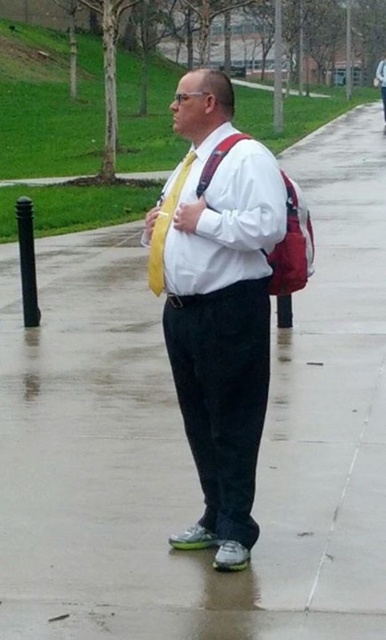
Question: Does white smooth shirt at center have a larger size compared to white matte dress shirt at center?

Choices:
 (A) yes
 (B) no

Answer: (B)

Question: Does matte yellow tie at center have a lesser width compared to yellow satin tie at center?

Choices:
 (A) yes
 (B) no

Answer: (B)

Question: Which point is closer to the camera?

Choices:
 (A) (265, 179)
 (B) (162, 253)
 (C) (384, 83)
 (D) (206, 516)

Answer: (A)

Question: Is the position of matte yellow tie at center more distant than that of white smooth shirt at center?

Choices:
 (A) no
 (B) yes

Answer: (B)

Question: Estimate the real-world distances between objects in this image. Which object is closer to the matte yellow tie at center?

Choices:
 (A) yellow satin tie at center
 (B) white matte dress shirt at center
 (C) white smooth shirt at center

Answer: (C)

Question: Which point is farther to the camera?

Choices:
 (A) yellow satin tie at center
 (B) white smooth shirt at center
 (C) matte yellow tie at center
 (D) white matte dress shirt at center

Answer: (D)